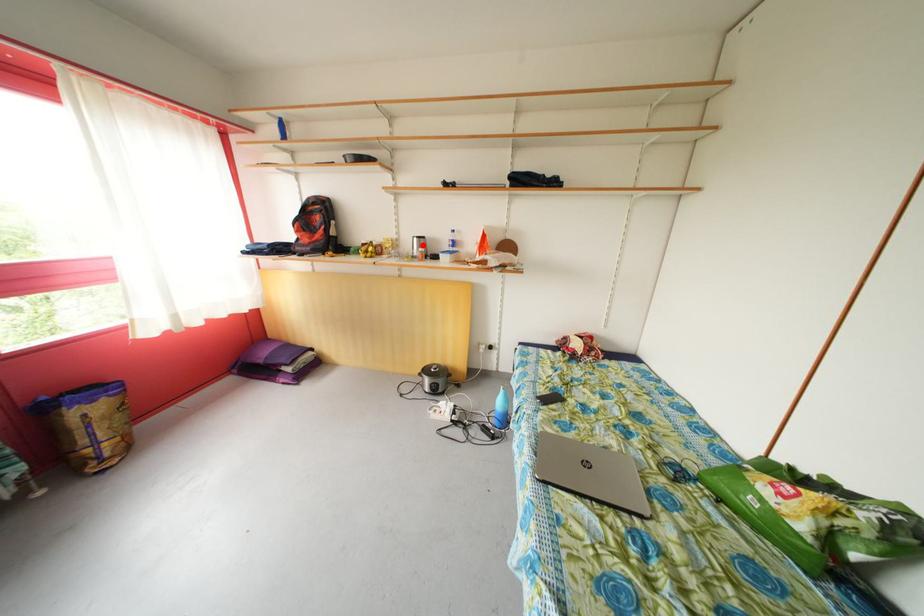
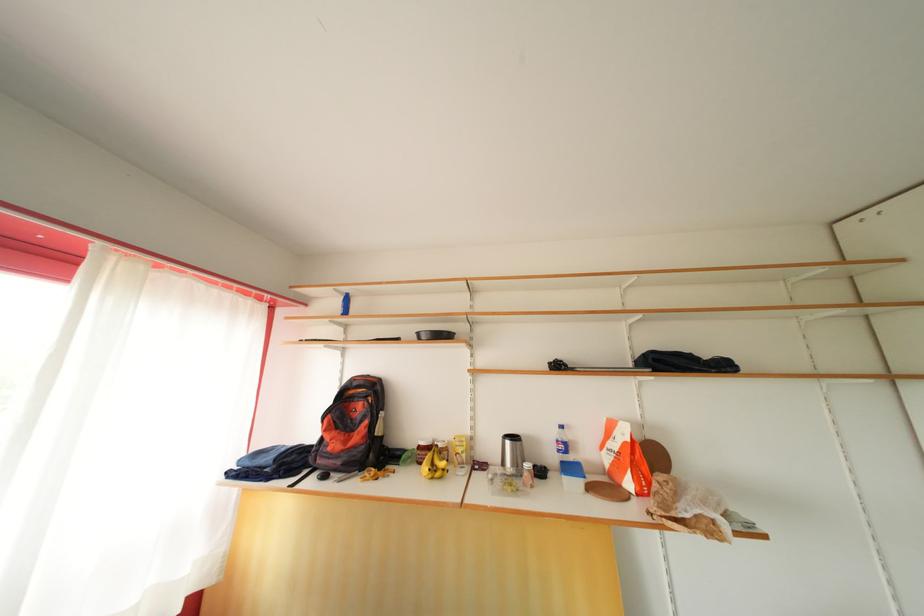
In the second image, find the point that corresponds to the highlighted location in the first image.

(515, 448)